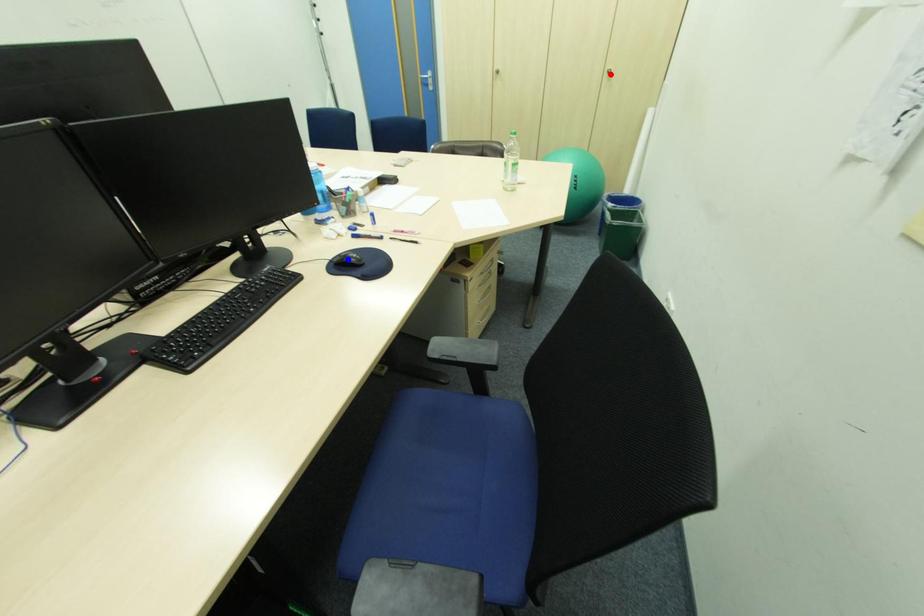
Question: Which of the two points in the image is closer to the camera?

Choices:
 (A) Blue point is closer.
 (B) Red point is closer.

Answer: (A)